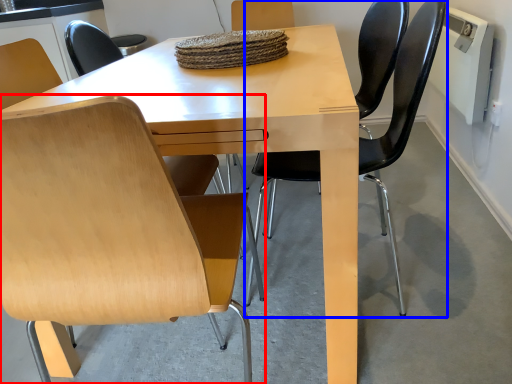
Question: Among these objects, which one is farthest to the camera, chair (highlighted by a red box) or chair (highlighted by a blue box)?

Choices:
 (A) chair
 (B) chair

Answer: (B)